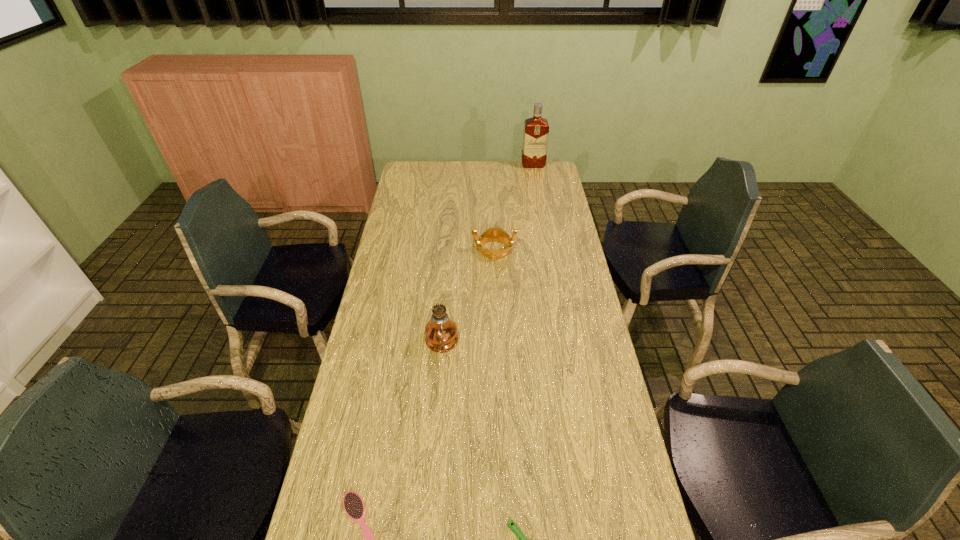
This screenshot has width=960, height=540. I want to click on the second closest object relative to the right hairbrush, so click(441, 335).

Identify the location of free space that satisfies the following two spatial constraints: 1. at the front emblem of the second farthest object; 2. on the front side of the fourth object from right to left. This screenshot has width=960, height=540. (497, 344).